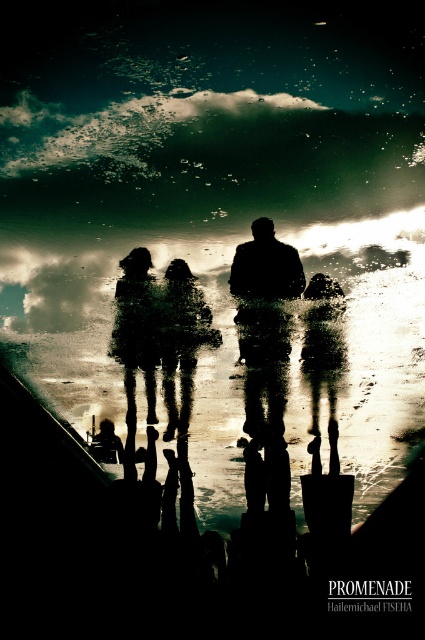
Is matte black figure at center taller than silhouette figure at center?

Yes, matte black figure at center is taller than silhouette figure at center.

Is point (176, 333) positioned in front of point (149, 376)?

Yes, it is in front of point (149, 376).

This screenshot has height=640, width=425. I want to click on matte black figure at center, so click(x=183, y=340).

Does silhouette figure at center have a lesser width compared to matte black pants at center?

Indeed, silhouette figure at center has a lesser width compared to matte black pants at center.

Is point (149, 404) less distant than point (326, 292)?

No, it is behind (326, 292).

Between point (139, 291) and point (311, 323), which one is positioned in front?

Point (139, 291)

Where is `silhouette figure at center`? Image resolution: width=425 pixels, height=640 pixels. silhouette figure at center is located at coordinates (136, 321).

Does matte black figure at center appear on the left side of matte black pants at center?

Yes, matte black figure at center is to the left of matte black pants at center.

Is matte black figure at center to the right of matte black pants at center from the viewer's perspective?

Incorrect, matte black figure at center is not on the right side of matte black pants at center.

Who is more forward, (203, 301) or (317, 340)?

Point (203, 301) is more forward.

Identify the location of matte black figure at center. (183, 340).